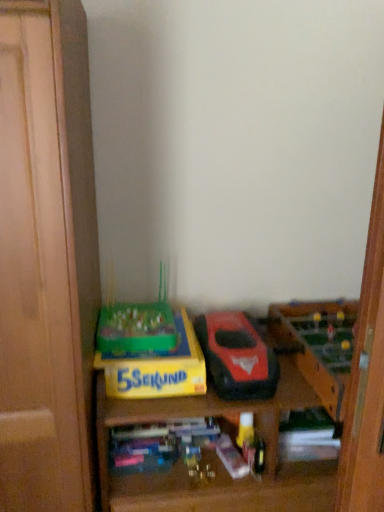
Question: Considering the relative positions of yellow cardboard box at lower center and shiny red plastic toy car at center in the image provided, is yellow cardboard box at lower center to the left or to the right of shiny red plastic toy car at center?

Choices:
 (A) right
 (B) left

Answer: (B)

Question: Considering the positions of point pyautogui.click(x=190, y=378) and point pyautogui.click(x=221, y=314), is point pyautogui.click(x=190, y=378) closer or farther from the camera than point pyautogui.click(x=221, y=314)?

Choices:
 (A) farther
 (B) closer

Answer: (B)

Question: Estimate the real-world distances between objects in this image. Which object is closer to the yellow cardboard box at lower center?

Choices:
 (A) green plastic game at center, which is the first toy in left-to-right order
 (B) wooden shelf at lower center
 (C) wooden foosball table at right, marked as the first toy in a right-to-left arrangement
 (D) shiny red plastic toy car at center

Answer: (A)

Question: Which of these objects is positioned closest to the yellow cardboard box at lower center?

Choices:
 (A) wooden foosball table at right, marked as the first toy in a right-to-left arrangement
 (B) wooden shelf at lower center
 (C) green plastic game at center, which is the first toy in left-to-right order
 (D) shiny red plastic toy car at center

Answer: (C)